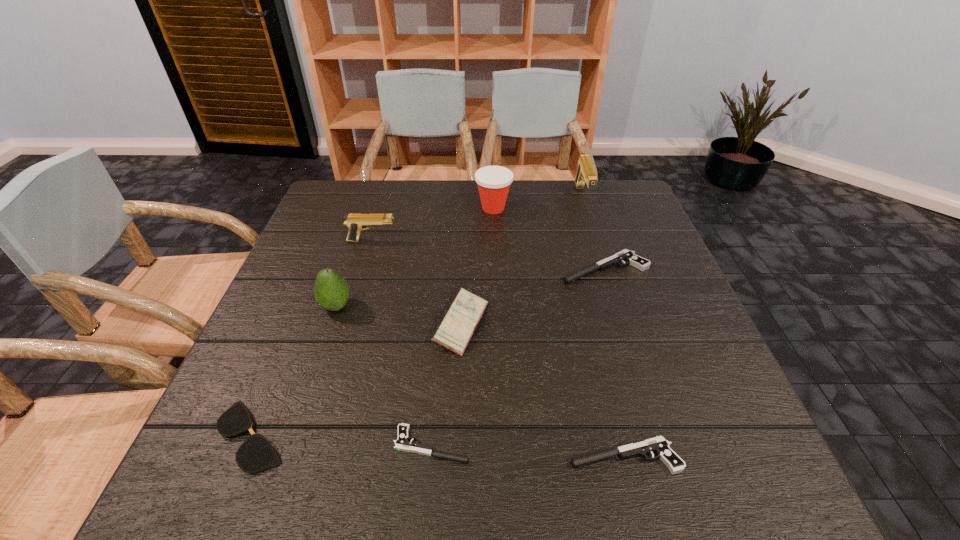
Where is `the right tan pistol`? Image resolution: width=960 pixels, height=540 pixels. the right tan pistol is located at coordinates (585, 173).

This screenshot has width=960, height=540. I want to click on the tallest pistol, so click(x=585, y=173).

The image size is (960, 540). Find the location of `red-orange Dixie cup`. red-orange Dixie cup is located at coordinates (493, 182).

At what (x,y) coordinates should I click in order to perform the action: click on avocado. Please return your answer as a coordinate pair (x, y). Looking at the image, I should click on (331, 291).

The height and width of the screenshot is (540, 960). Find the location of `the fourth nearest pistol`. the fourth nearest pistol is located at coordinates (355, 222).

Where is `the second tallest pistol`? The image size is (960, 540). the second tallest pistol is located at coordinates (355, 222).

This screenshot has height=540, width=960. I want to click on diary, so click(461, 319).

Where is `pink diary`? This screenshot has height=540, width=960. pink diary is located at coordinates (461, 319).

Locate an element on the screen. The image size is (960, 540). the third shortest pistol is located at coordinates (629, 257).

Where is `the biggest black pistol`? The image size is (960, 540). the biggest black pistol is located at coordinates pos(629,257).